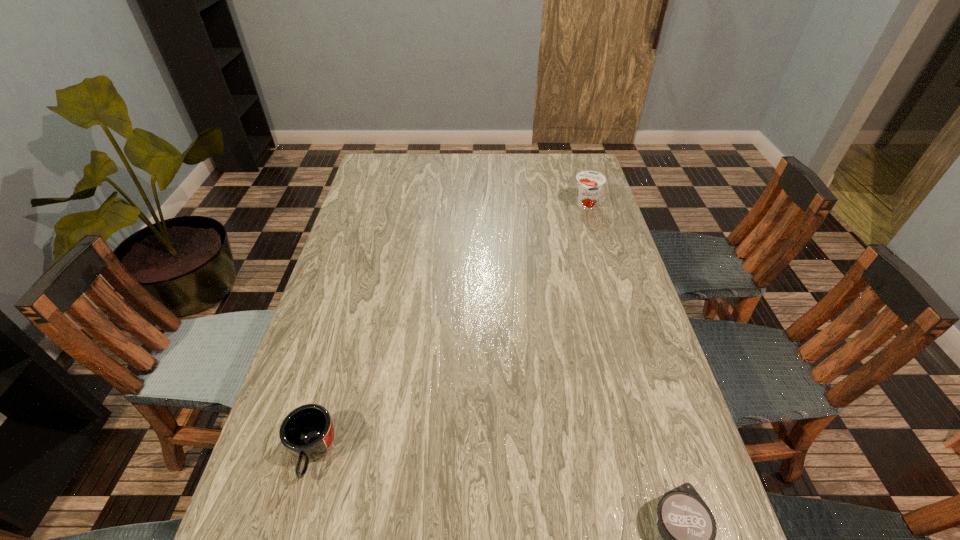
Locate an element on the screen. vacant space at the right edge of the desktop is located at coordinates (611, 264).

The height and width of the screenshot is (540, 960). What are the coordinates of `vacant space at the far left corner of the desktop` in the screenshot? It's located at (400, 178).

Locate an element on the screen. The width and height of the screenshot is (960, 540). free spot between the taller yogurt and the mug is located at coordinates (x=449, y=329).

I want to click on empty location between the tallest object and the mug, so click(449, 329).

What are the coordinates of `free point between the tallest object and the second shortest object` in the screenshot? It's located at (449, 329).

This screenshot has height=540, width=960. I want to click on free point between the mug and the tallest object, so click(449, 329).

The height and width of the screenshot is (540, 960). In order to click on object identified as the second closest to the nearer yogurt in this screenshot , I will do `click(589, 183)`.

Identify which object is the nearest to the nearer yogurt. Please provide its 2D coordinates. Your answer should be formatted as a tuple, i.e. [(x, y)], where the tuple contains the x and y coordinates of a point satisfying the conditions above.

[(307, 432)]